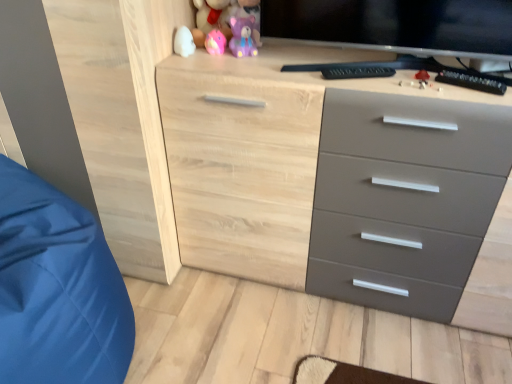
Where is `free spot above natural wood chest of drawers at center (from a real-world perspective)`? The image size is (512, 384). free spot above natural wood chest of drawers at center (from a real-world perspective) is located at coordinates (352, 70).